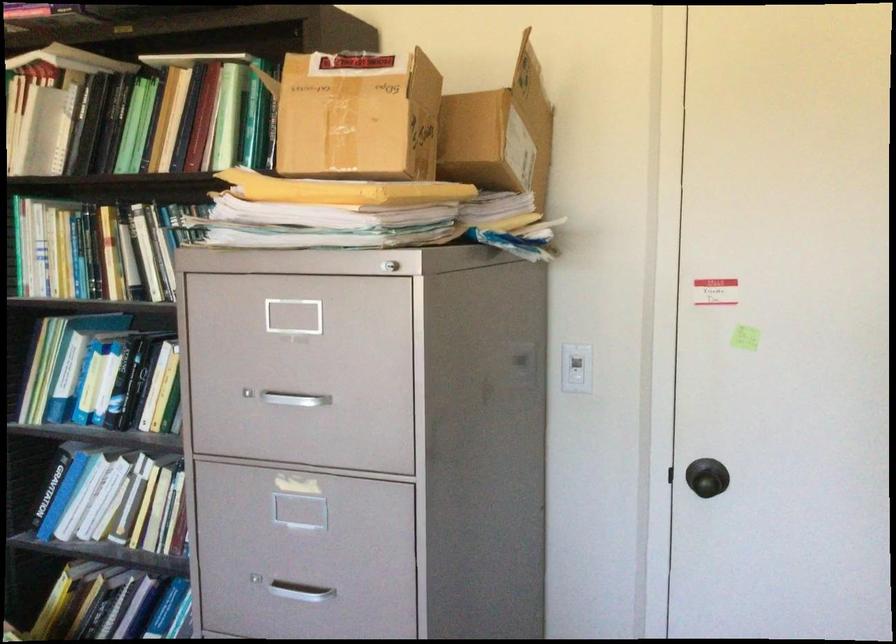
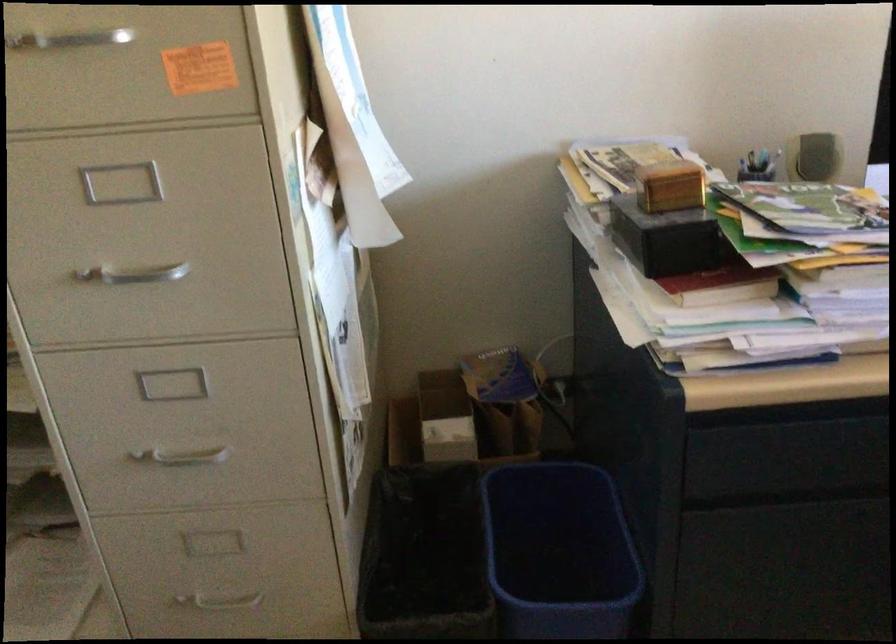
Looking at this image, based on the continuous images, in which direction is the camera rotating?

The rotation direction of the camera is right-down.